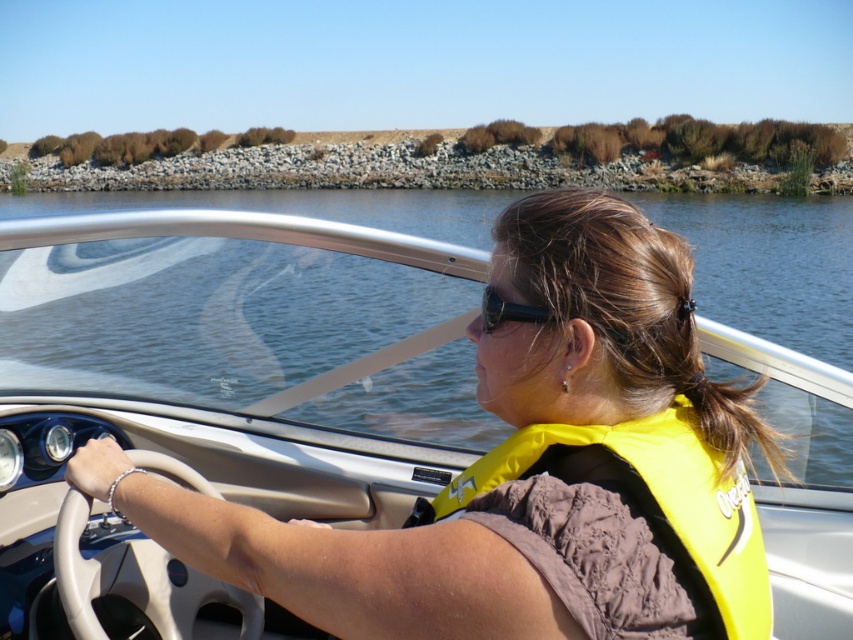
Question: Does white leather steering wheel at center have a greater width compared to black plastic sunglasses at upper center?

Choices:
 (A) yes
 (B) no

Answer: (A)

Question: Is white leather steering wheel at center below black plastic sunglasses at upper center?

Choices:
 (A) yes
 (B) no

Answer: (A)

Question: Estimate the real-world distances between objects in this image. Which object is farther from the black plastic sunglasses at upper center?

Choices:
 (A) yellow fabric life vest at center
 (B) white leather steering wheel at center
 (C) matte white steering wheel at center

Answer: (C)

Question: Which of the following is the farthest from the observer?

Choices:
 (A) (527, 307)
 (B) (200, 580)
 (C) (494, 470)
 (D) (422, 476)

Answer: (D)

Question: Which of these objects is positioned farthest from the white leather steering wheel at center?

Choices:
 (A) yellow fabric life vest at center
 (B) black plastic sunglasses at upper center

Answer: (B)

Question: In this image, where is white leather steering wheel at center located relative to black plastic sunglasses at upper center?

Choices:
 (A) above
 (B) below

Answer: (B)